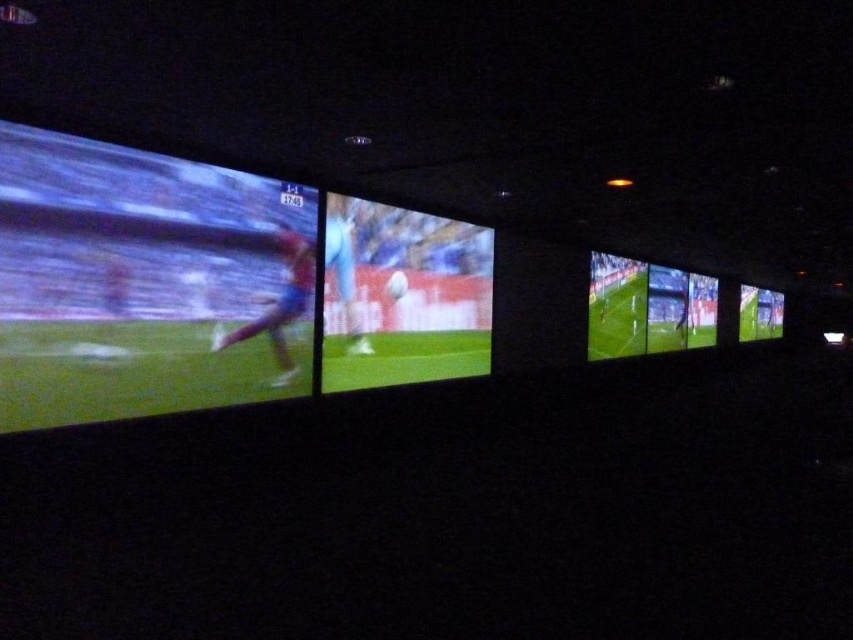
Question: Is matte green screen at left above light blue jersey at center?

Choices:
 (A) yes
 (B) no

Answer: (B)

Question: Considering the relative positions of matte green screen at left and matte red soccer player at center in the image provided, where is matte green screen at left located with respect to matte red soccer player at center?

Choices:
 (A) left
 (B) right

Answer: (A)

Question: Is matte green screen at left positioned before matte red soccer player at center?

Choices:
 (A) yes
 (B) no

Answer: (A)

Question: Which is farther from the light blue jersey at center?

Choices:
 (A) matte red soccer player at center
 (B) matte green screen at left

Answer: (B)

Question: Which object is the farthest from the light blue jersey at center?

Choices:
 (A) matte green screen at left
 (B) matte green screen at center
 (C) matte red soccer player at center

Answer: (A)

Question: Estimate the real-world distances between objects in this image. Which object is farther from the matte green screen at center?

Choices:
 (A) light blue jersey at center
 (B) matte red soccer player at center
 (C) matte green screen at left

Answer: (C)